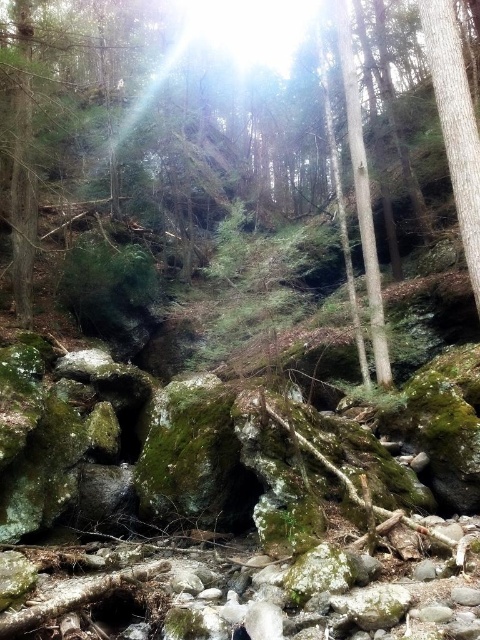
You are a hiker who wants to place a small backpack on the green mossy rock at center without it falling off. Considering the smooth bark tree at right is nearby, which object provides a more stable surface for the backpack?

The green mossy rock at center provides a more stable surface for the backpack because it is positioned over the smooth bark tree at right, indicating it has a larger base area and better stability.

You are standing in the forest and want to place a small potted plant between the green mossy rock at center and the smooth bark tree at right. Based on their positions, which object should the plant be closer to?

The green mossy rock at center is closer to the viewer than the smooth bark tree at right, so the plant should be placed closer to the smooth bark tree at right to maintain equal distance between both objects.

You are a hiker who wants to place a small backpack between the green mossy rock at center and the smooth bark tree at right. Based on their positions, which object should you place the backpack closer to if you want it to be nearer to the tree?

The backpack should be placed closer to the smooth bark tree at right because the green mossy rock at center is to the left of the smooth bark tree at right, meaning the tree is on the right side relative to the rock.